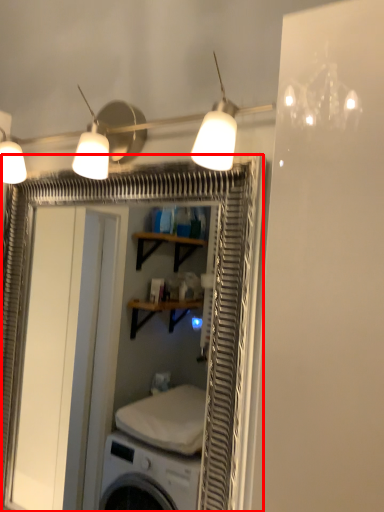
Question: Where is screen door (annotated by the red box) located in relation to lamp in the image?

Choices:
 (A) left
 (B) right

Answer: (A)